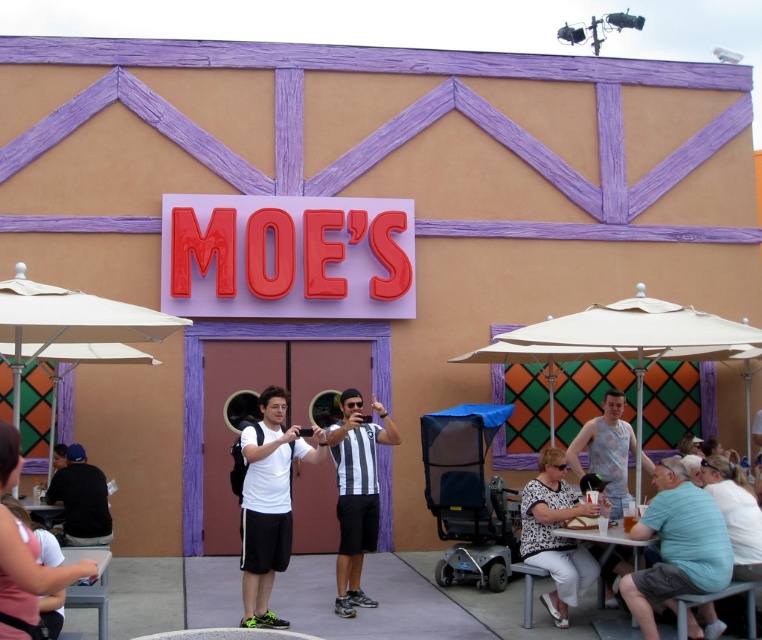
You are a photographer trying to capture a clear shot of the dark blue shirt at lower left without any obstructions. The white fabric umbrella at right is in the way. Can you adjust your position so that the umbrella doesn not block the view of the shirt?

The white fabric umbrella at right is shorter than the dark blue shirt at lower left. Since the umbrella is shorter, moving your camera position slightly to the side or adjusting the angle could allow you to capture the dark blue shirt at lower left without the umbrella blocking it.

You are standing in front of the building at Moe s themed area and want to take a photo. There are two points marked in the scene, point (674, 534) and point (85, 509). Which point is closer to you?

Point (674, 534) is closer to the viewer than point (85, 509).